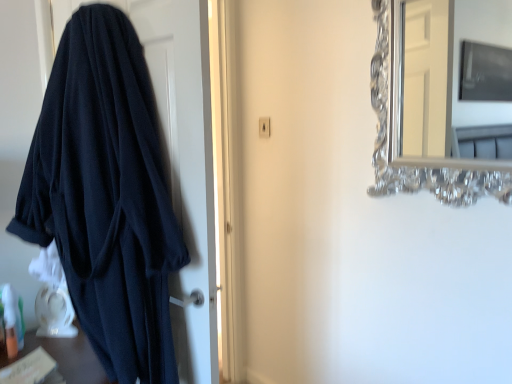
Question: From a real-world perspective, is dark blue fabric at left on silver metallic mirror at upper right?

Choices:
 (A) no
 (B) yes

Answer: (A)

Question: Can you confirm if dark blue fabric at left is wider than silver metallic mirror at upper right?

Choices:
 (A) no
 (B) yes

Answer: (B)

Question: Is dark blue fabric at left at the right side of silver metallic mirror at upper right?

Choices:
 (A) yes
 (B) no

Answer: (B)

Question: Is the depth of dark blue fabric at left greater than that of silver metallic mirror at upper right?

Choices:
 (A) yes
 (B) no

Answer: (A)

Question: Is dark blue fabric at left shorter than silver metallic mirror at upper right?

Choices:
 (A) yes
 (B) no

Answer: (B)

Question: From the image's perspective, is dark blue fabric at left on top of silver metallic mirror at upper right?

Choices:
 (A) no
 (B) yes

Answer: (A)

Question: Is silver metallic mirror at upper right at the left side of dark blue fabric at left?

Choices:
 (A) yes
 (B) no

Answer: (B)

Question: Is silver metallic mirror at upper right far away from dark blue fabric at left?

Choices:
 (A) yes
 (B) no

Answer: (A)

Question: Is silver metallic mirror at upper right shorter than dark blue fabric at left?

Choices:
 (A) no
 (B) yes

Answer: (B)

Question: Considering the relative sizes of silver metallic mirror at upper right and dark blue fabric at left in the image provided, is silver metallic mirror at upper right thinner than dark blue fabric at left?

Choices:
 (A) yes
 (B) no

Answer: (A)

Question: Does silver metallic mirror at upper right appear on the right side of dark blue fabric at left?

Choices:
 (A) no
 (B) yes

Answer: (B)

Question: Is silver metallic mirror at upper right outside of dark blue fabric at left?

Choices:
 (A) no
 (B) yes

Answer: (B)

Question: Is dark blue fabric at left bigger or smaller than silver metallic mirror at upper right?

Choices:
 (A) big
 (B) small

Answer: (A)